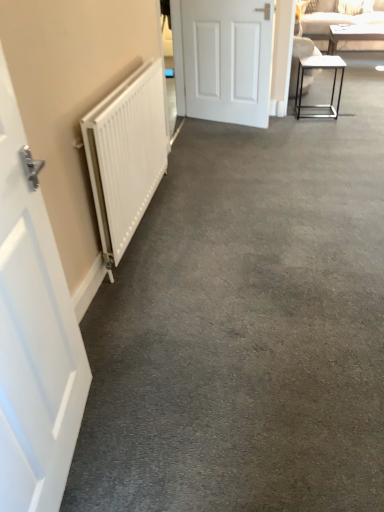
Question: In terms of size, does metallic frame table at right, marked as the 2th table in a back-to-front arrangement, appear bigger or smaller than white matte door at left, positioned as the 1th door in bottom-to-top order?

Choices:
 (A) small
 (B) big

Answer: (A)

Question: From a real-world perspective, is metallic frame table at right, the first table viewed from the left, physically located above or below white matte door at left, which is counted as the first door, starting from the left?

Choices:
 (A) below
 (B) above

Answer: (A)

Question: Which of these objects is positioned closest to the white glossy table at upper right, marked as the 1th table in a right-to-left arrangement?

Choices:
 (A) white matte door at left, positioned as the 1th door in bottom-to-top order
 (B) beige fabric couch at upper right
 (C) metallic frame table at right, marked as the 2th table in a back-to-front arrangement
 (D) white matte radiator at left
 (E) white matte door at center, the first door viewed from the back

Answer: (B)

Question: Considering the real-world distances, which object is closest to the white matte door at left, which is the 2th door in back-to-front order?

Choices:
 (A) white matte door at center, the first door viewed from the back
 (B) white glossy table at upper right, which is counted as the first table, starting from the top
 (C) beige fabric couch at upper right
 (D) white matte radiator at left
 (E) metallic frame table at right, arranged as the first table when ordered from the bottom

Answer: (D)